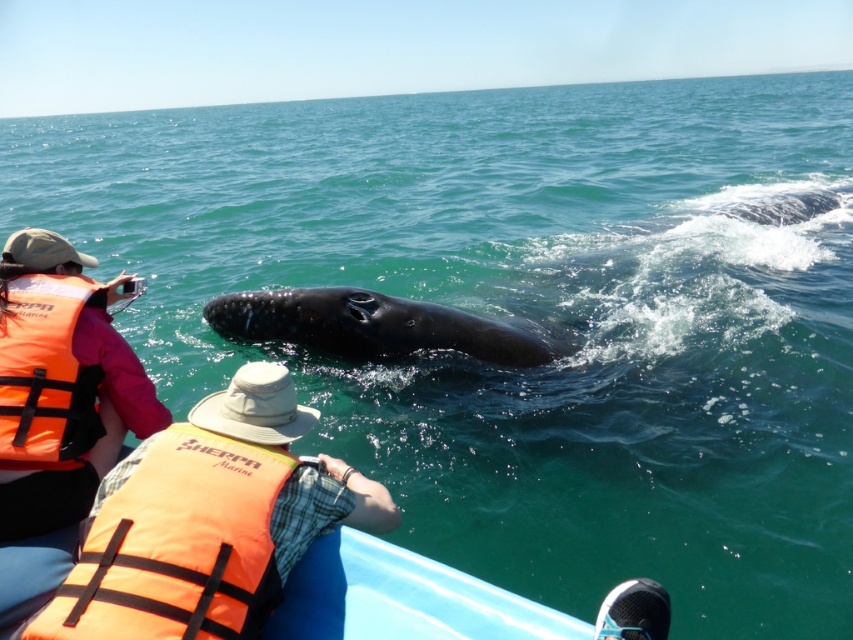
Question: Observing the image, what is the correct spatial positioning of orange fabric life jacket at lower left in reference to black smooth humpback whale at center?

Choices:
 (A) below
 (B) above

Answer: (A)

Question: Which is farther from the orange fabric life jacket at lower left?

Choices:
 (A) orange life jacket at left
 (B) black smooth humpback whale at center

Answer: (B)

Question: Can you confirm if black smooth humpback whale at center is positioned below orange life jacket at left?

Choices:
 (A) yes
 (B) no

Answer: (B)

Question: Where is orange life vest at left located in relation to orange life jacket at left in the image?

Choices:
 (A) left
 (B) right

Answer: (B)

Question: Which object appears closest to the camera in this image?

Choices:
 (A) orange fabric life jacket at lower left
 (B) orange life vest at left
 (C) orange life jacket at left
 (D) black smooth humpback whale at center

Answer: (A)

Question: Among these points, which one is nearest to the camera?

Choices:
 (A) (160, 444)
 (B) (78, 310)
 (C) (74, 257)

Answer: (A)